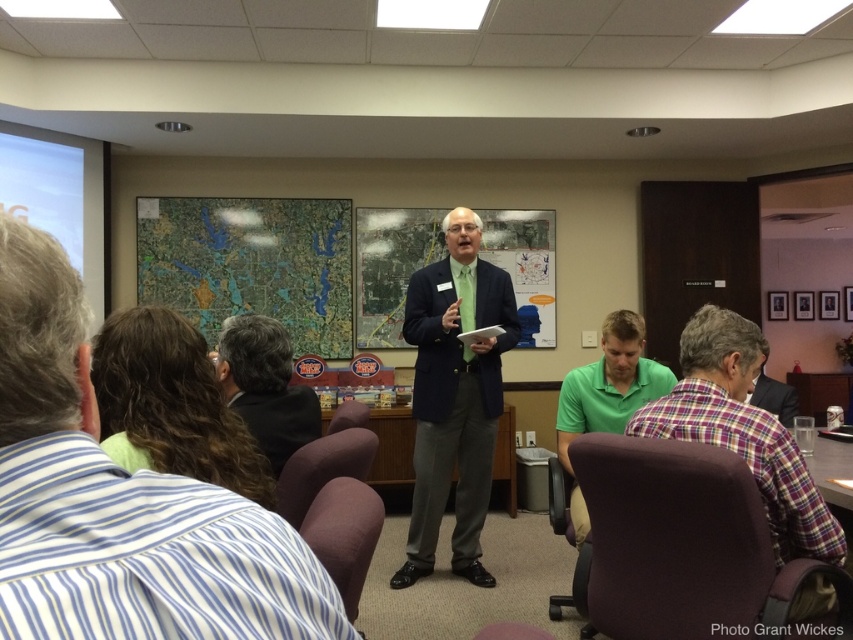
At what (x,y) coordinates should I click in order to perform the action: click on striped shirt at left. Please return your answer as a coordinate pair (x, y). This screenshot has width=853, height=640. Looking at the image, I should click on (120, 500).

What do you see at coordinates (741, 429) in the screenshot? I see `plaid fabric shirt at lower right` at bounding box center [741, 429].

Measure the distance from plaid fabric shirt at lower right to dark brown hair at center.

plaid fabric shirt at lower right is 3.61 feet away from dark brown hair at center.

Between point (788, 472) and point (254, 330), which one is positioned behind?

Positioned behind is point (254, 330).

At what (x,y) coordinates should I click in order to perform the action: click on plaid fabric shirt at lower right. Please return your answer as a coordinate pair (x, y). The image size is (853, 640). Looking at the image, I should click on (741, 429).

From the picture: Can you confirm if green matte suit at center is positioned below plaid fabric shirt at center?

No.

Who is positioned more to the right, green matte suit at center or plaid fabric shirt at center?

plaid fabric shirt at center is more to the right.

Does point (442, 333) come farther from viewer compared to point (788, 387)?

No.

Identify the location of green matte suit at center. point(454,396).